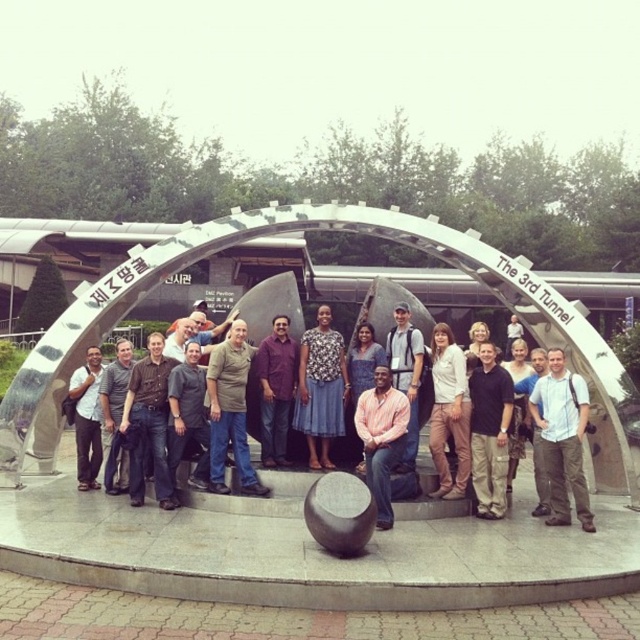
You are a photographer trying to capture a group photo of the white cotton shirt at center and the purple shirt at center. Which person should you move closer to the camera to ensure both shirts are equally visible in the photo?

The white cotton shirt at center has a larger width than the purple shirt at center. To make both shirts equally visible, move the purple shirt at center closer to the camera so that its apparent size matches the white cotton shirt at center.

You are a photographer trying to capture a wide shot of the group. The denim jacket at center and the pink cotton shirt at center are both in the frame. Which clothing item takes up more horizontal space in the photo?

The pink cotton shirt at center takes up more horizontal space because its width is greater than the denim jacket at center.